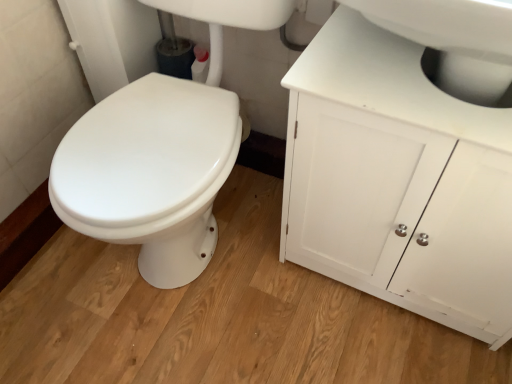
The height and width of the screenshot is (384, 512). I want to click on free space above white matte cabinet at upper right (from a real-world perspective), so click(401, 66).